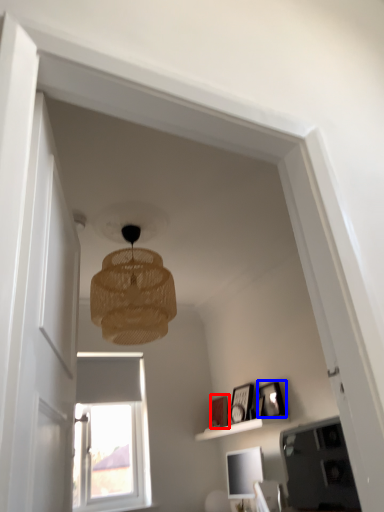
Question: Among these objects, which one is farthest to the camera, picture frame (highlighted by a red box) or picture frame (highlighted by a blue box)?

Choices:
 (A) picture frame
 (B) picture frame

Answer: (A)